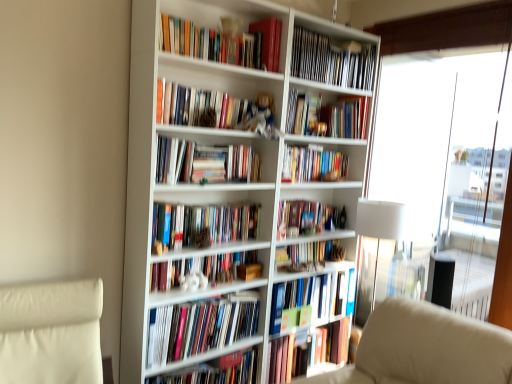
Image resolution: width=512 pixels, height=384 pixels. Describe the element at coordinates (379, 226) in the screenshot. I see `white fabric lampshade at right` at that location.

What is the approximate width of shiny gold ornament at upper center, marked as the 3th book in a top-to-bottom arrangement?

shiny gold ornament at upper center, marked as the 3th book in a top-to-bottom arrangement, is 24.89 centimeters wide.

What do you see at coordinates (261, 117) in the screenshot? The image size is (512, 384). I see `matte plastic doll at upper center` at bounding box center [261, 117].

Describe the element at coordinates (202, 225) in the screenshot. I see `hardcover books at center, acting as the sixth book starting from the top` at that location.

Where is `matte red book at upper center, placed as the first paperback book when sorted from right to left`? matte red book at upper center, placed as the first paperback book when sorted from right to left is located at coordinates (269, 41).

The height and width of the screenshot is (384, 512). I want to click on swivel chair in front of the matte plastic doll at upper center, so click(51, 333).

Can you confirm if white leather swivel chair at lower left is shorter than matte plastic doll at upper center?

Incorrect, the height of white leather swivel chair at lower left does not fall short of that of matte plastic doll at upper center.

From the image's perspective, between white leather swivel chair at lower left and matte plastic doll at upper center, which one is located above?

matte plastic doll at upper center.

Based on the photo, is white leather swivel chair at lower left at the right side of matte plastic doll at upper center?

Incorrect, white leather swivel chair at lower left is not on the right side of matte plastic doll at upper center.

From the image's perspective, is hardcover book at center, which ranks as the second paperback book in top-to-bottom order, on hardcover books at upper center, acting as the 1th book starting from the top?

No, from the image's perspective, hardcover book at center, which ranks as the second paperback book in top-to-bottom order, is not on top of hardcover books at upper center, acting as the 1th book starting from the top.

Is hardcover book at center, the first paperback book when ordered from left to right, in front of or behind hardcover books at upper center, arranged as the 13th book when ordered from the bottom, in the image?

hardcover book at center, the first paperback book when ordered from left to right, is behind hardcover books at upper center, arranged as the 13th book when ordered from the bottom.

From a real-world perspective, is hardcover book at center, which ranks as the second paperback book in top-to-bottom order, above or below hardcover books at upper center, arranged as the 13th book when ordered from the bottom?

From a real-world perspective, hardcover book at center, which ranks as the second paperback book in top-to-bottom order, is physically below hardcover books at upper center, arranged as the 13th book when ordered from the bottom.

The width and height of the screenshot is (512, 384). Find the location of `book that is the 8th one when counting upward from the hardcover book at center, which is the 13th book from top to bottom (from the image's perspective)`. book that is the 8th one when counting upward from the hardcover book at center, which is the 13th book from top to bottom (from the image's perspective) is located at coordinates (312, 164).

Is hardcover book at center, which is the 13th book from top to bottom, positioned before hardcover book at center, which is counted as the 5th book, starting from the top?

Yes, hardcover book at center, which is the 13th book from top to bottom, is closer to the viewer.

Which of these two, hardcover book at center, the 1th book from the bottom, or hardcover book at center, which is counted as the 5th book, starting from the top, stands taller?

hardcover book at center, the 1th book from the bottom, is taller.

From a real-world perspective, between hardcover book at center, the 2th paperback book in the right-to-left sequence, and matte plastic doll at upper center, who is vertically higher?

matte plastic doll at upper center is physically above.

Is hardcover book at center, the first paperback book in the bottom-to-top sequence, bigger or smaller than matte plastic doll at upper center?

In the image, hardcover book at center, the first paperback book in the bottom-to-top sequence, appears to be smaller than matte plastic doll at upper center.

Looking at this image, between hardcover book at center, which ranks as the second paperback book in top-to-bottom order, and matte plastic doll at upper center, which one is positioned behind?

hardcover book at center, which ranks as the second paperback book in top-to-bottom order, is more distant.

How distant is hardcover book at center, the first paperback book when ordered from left to right, from matte plastic doll at upper center?

A distance of 29.88 centimeters exists between hardcover book at center, the first paperback book when ordered from left to right, and matte plastic doll at upper center.

Measure the distance from matte brown book at center, which ranks as the second book in bottom-to-top order, to white leather swivel chair at lower left.

matte brown book at center, which ranks as the second book in bottom-to-top order, is 1.35 meters from white leather swivel chair at lower left.

Which object is positioned more to the right, matte brown book at center, the twelfth book viewed from the top, or white leather swivel chair at lower left?

matte brown book at center, the twelfth book viewed from the top.

Consider the image. Considering the sizes of objects matte brown book at center, the twelfth book viewed from the top, and white leather swivel chair at lower left in the image provided, who is thinner, matte brown book at center, the twelfth book viewed from the top, or white leather swivel chair at lower left?

With smaller width is matte brown book at center, the twelfth book viewed from the top.

Is hardcover book at center, which is the ninth book from bottom to top, positioned behind white fabric lampshade at right?

Yes, it is behind white fabric lampshade at right.

Which of these two, hardcover book at center, which is the ninth book from bottom to top, or white fabric lampshade at right, is wider?

white fabric lampshade at right is wider.

Could you tell me if hardcover book at center, which is counted as the 5th book, starting from the top, is facing white fabric lampshade at right?

No, hardcover book at center, which is counted as the 5th book, starting from the top, does not turn towards white fabric lampshade at right.

Considering the positions of objects matte red book at upper center, placed as the first paperback book when sorted from right to left, and hardcover books at center, acting as the 8th book starting from the bottom, in the image provided, who is more to the left, matte red book at upper center, placed as the first paperback book when sorted from right to left, or hardcover books at center, acting as the 8th book starting from the bottom,?

hardcover books at center, acting as the 8th book starting from the bottom.

Is matte red book at upper center, placed as the first paperback book when sorted from right to left, completely or partially outside of hardcover books at center, acting as the 8th book starting from the bottom?

Indeed, matte red book at upper center, placed as the first paperback book when sorted from right to left, is completely outside hardcover books at center, acting as the 8th book starting from the bottom.

Does matte red book at upper center, the second paperback book positioned from the bottom, touch hardcover books at center, acting as the 8th book starting from the bottom?

No.

The width and height of the screenshot is (512, 384). In order to click on doll behind the white leather swivel chair at lower left in this screenshot , I will do [261, 117].

I want to click on the 6th book in front of the hardcover book at center, the first paperback book when ordered from left to right, counting from the anchor's position, so click(225, 43).

Which object lies nearer to the anchor point hardcover book at center, which is the ninth book from bottom to top, hardcover book at center, the 2th paperback book in the right-to-left sequence, or hardcover book at center, the 1th book from the bottom?

hardcover book at center, the 2th paperback book in the right-to-left sequence.

From the image, which object appears to be farther from transparent glass window at right, white leather swivel chair at lower left or hardcover books at upper center, which is the fourth book in top-to-bottom order?

white leather swivel chair at lower left lies further to transparent glass window at right than the other object.

Looking at the image, which one is located closer to transparent glass window at right, matte plastic books at upper right, the 2th book when ordered from top to bottom, or hardcover books at center, placed as the 3th book when sorted from bottom to top?

The object closer to transparent glass window at right is matte plastic books at upper right, the 2th book when ordered from top to bottom.

From the image, which object appears to be farther from hardcover book at center, which is the ninth book from bottom to top, green matte book at center, the 4th book ordered from the bottom, or shiny gold ornament at upper center, marked as the 3th book in a top-to-bottom arrangement?

Among the two, green matte book at center, the 4th book ordered from the bottom, is located further to hardcover book at center, which is the ninth book from bottom to top.

Based on their spatial positions, is hardcover book at center, the first paperback book in the bottom-to-top sequence, or hardcover book at center, the 1th book from the bottom, closer to hardcover books at upper center, which is the 10th book from bottom to top?

Among the two, hardcover book at center, the first paperback book in the bottom-to-top sequence, is located nearer to hardcover books at upper center, which is the 10th book from bottom to top.

Based on their spatial positions, is transparent glass window at right or matte red book at upper center, which is counted as the 2th paperback book, starting from the left, further from hardcover book at center, the 1th book from the bottom?

matte red book at upper center, which is counted as the 2th paperback book, starting from the left.

Looking at the image, which one is located closer to hardcover books at center, acting as the eleventh book starting from the top, matte plastic books at upper right, the 2th book when ordered from top to bottom, or hardcover book at center, the 1th book from the bottom?

hardcover book at center, the 1th book from the bottom, is closer to hardcover books at center, acting as the eleventh book starting from the top.

Estimate the real-world distances between objects in this image. Which object is further from wooden toy at center, the fifth book in the bottom-to-top sequence, hardcover book at center, which is the 13th book from top to bottom, or transparent glass window at right?

Based on the image, transparent glass window at right appears to be further to wooden toy at center, the fifth book in the bottom-to-top sequence.

Where is `bookcase between hardcover books at center, acting as the eleventh book starting from the top, and white fabric lampshade at right`? The width and height of the screenshot is (512, 384). bookcase between hardcover books at center, acting as the eleventh book starting from the top, and white fabric lampshade at right is located at coordinates (227, 186).

Where is `swivel chair between matte red book at upper center, which is counted as the 2th paperback book, starting from the left, and matte brown book at center, which ranks as the second book in bottom-to-top order, in the up-down direction`? swivel chair between matte red book at upper center, which is counted as the 2th paperback book, starting from the left, and matte brown book at center, which ranks as the second book in bottom-to-top order, in the up-down direction is located at coordinates (51, 333).

The image size is (512, 384). Identify the location of bookcase between matte plastic books at upper right, the 2th book when ordered from top to bottom, and hardcover book at center, placed as the seventh book when sorted from bottom to top, from top to bottom. (227, 186).

Where is `doll between matte plastic books at upper right, the 2th book when ordered from top to bottom, and green matte book at center, placed as the tenth book when sorted from top to bottom, in the up-down direction`? This screenshot has height=384, width=512. doll between matte plastic books at upper right, the 2th book when ordered from top to bottom, and green matte book at center, placed as the tenth book when sorted from top to bottom, in the up-down direction is located at coordinates (261, 117).